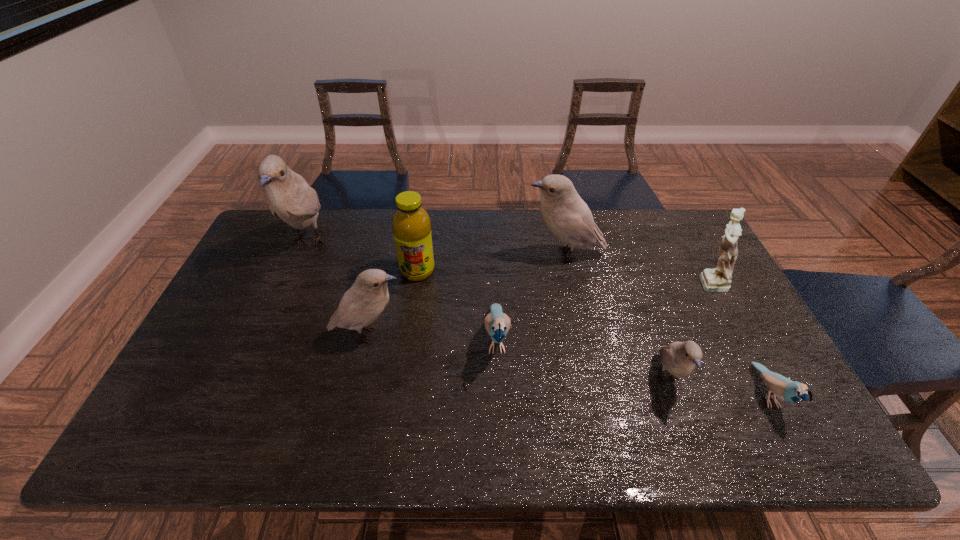
Where is `the biggest white bird`? the biggest white bird is located at coordinates (290, 197).

Find the location of a particular element. The height and width of the screenshot is (540, 960). the tallest bird is located at coordinates (290, 197).

You are a GUI agent. You are given a task and a screenshot of the screen. Output one action in this format:
    pyautogui.click(x=<x>, y=<y>)
    Task: Click on the second tallest bird
    The width and height of the screenshot is (960, 540).
    Given the screenshot: What is the action you would take?
    [568, 217]

Find the location of a particular element. the fourth object from right to left is located at coordinates (568, 217).

Find the location of `figurine`. figurine is located at coordinates (718, 279).

Locate an element on the screen. The image size is (960, 540). fruit juice is located at coordinates (411, 224).

Find the location of a particular element. The image size is (960, 540). the fourth shortest object is located at coordinates (368, 297).

This screenshot has height=540, width=960. I want to click on the third farthest white bird, so click(368, 297).

Find the location of `the smallest white bird`. the smallest white bird is located at coordinates click(x=679, y=358).

Locate an element on the screen. This screenshot has width=960, height=540. the fifth bird from left to right is located at coordinates (679, 358).